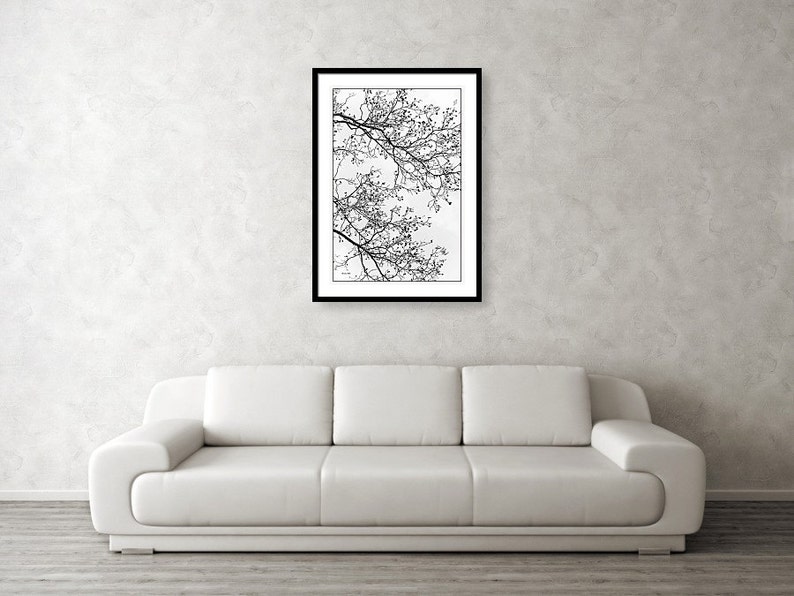
This screenshot has width=794, height=596. Find the location of `black picture frame`. black picture frame is located at coordinates (386, 69), (480, 235), (415, 300), (314, 235).